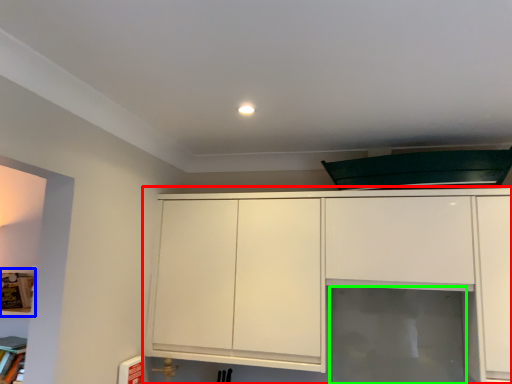
Question: Based on their relative distances, which object is farther from cabinetry (highlighted by a red box)? Choose from shelf (highlighted by a blue box) and glass door (highlighted by a green box).

Choices:
 (A) shelf
 (B) glass door

Answer: (A)